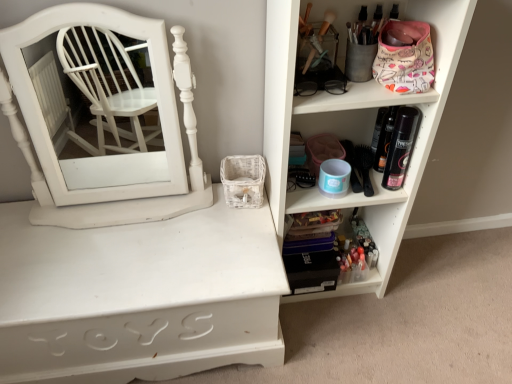
Question: Considering their positions, is white wood medicine cabinet at left located in front of or behind white plastic shelf at upper right, placed as the third shelf when sorted from left to right?

Choices:
 (A) behind
 (B) front

Answer: (A)

Question: In terms of size, does white wood medicine cabinet at left appear bigger or smaller than white plastic shelf at upper right, placed as the third shelf when sorted from left to right?

Choices:
 (A) big
 (B) small

Answer: (B)

Question: Estimate the real-world distances between objects in this image. Which object is farther from the white plastic shelf at upper right, placed as the third shelf when sorted from left to right?

Choices:
 (A) white painted wood shelf at center, marked as the 1th shelf in a left-to-right arrangement
 (B) white wood medicine cabinet at left
 (C) translucent plastic makeup at lower right, marked as the second shelf in a right-to-left arrangement

Answer: (B)

Question: Based on their relative distances, which object is farther from the white plastic shelf at upper right, placed as the third shelf when sorted from left to right?

Choices:
 (A) white wood medicine cabinet at left
 (B) translucent plastic makeup at lower right, which appears as the second shelf when viewed from the left
 (C) white painted wood shelf at center, marked as the 1th shelf in a left-to-right arrangement

Answer: (A)